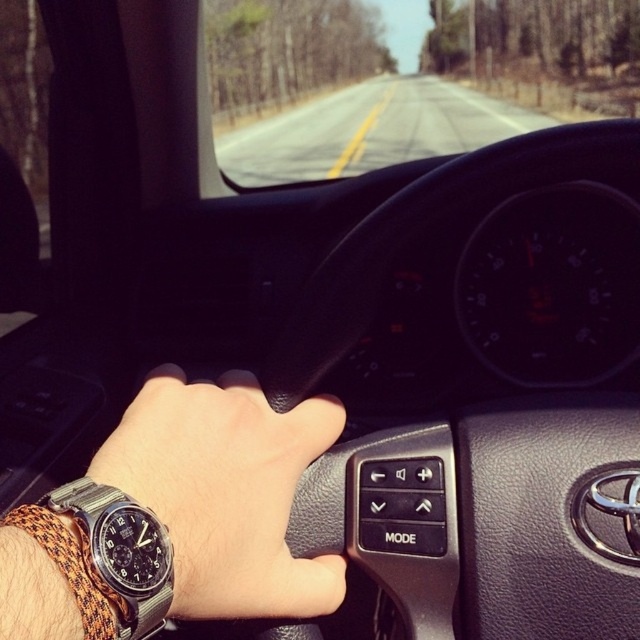
You are a driver checking your watch. You have two watches visible in your view, the leather watch at center and the silver metallic watch at lower left. Which watch is positioned to the right of the other?

The leather watch at center is positioned to the right of the silver metallic watch at lower left.

You are a passenger in the car and want to reach the point at coordinates (305, 339) in the image. The average human arm length is 26 inches. Can you reach it?

The point at coordinates (305, 339) is 27.15 inches from the camera, which is slightly longer than the average human arm length of 26 inches. Therefore, you may not be able to reach it comfortably without stretching.

You are a mechanic working on a car. You need to reach both the black leather steering wheel at center and the silver metallic watch at lower left. Which object is closer to you?

The silver metallic watch at lower left is closer to you because it is only 16.96 inches away from the black leather steering wheel at center, but since the steering wheel is at center and the watch is at lower left, the watch is closer.